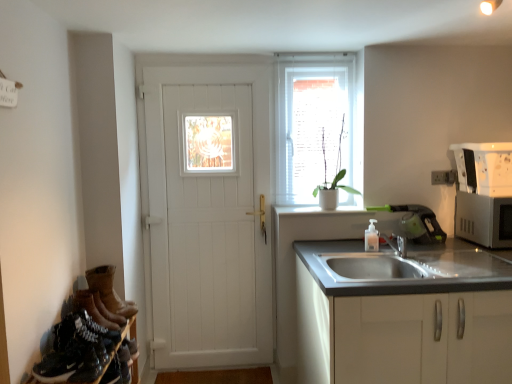
Question: Is black leather shoes at lower left in front of white wooden door at center?

Choices:
 (A) no
 (B) yes

Answer: (B)

Question: From the image's perspective, would you say black leather shoes at lower left is shown under white wooden door at center?

Choices:
 (A) yes
 (B) no

Answer: (A)

Question: Is there a large distance between black leather shoes at lower left and white wooden door at center?

Choices:
 (A) no
 (B) yes

Answer: (B)

Question: Is black leather shoes at lower left looking in the opposite direction of white wooden door at center?

Choices:
 (A) no
 (B) yes

Answer: (A)

Question: Is black leather shoes at lower left taller than white wooden door at center?

Choices:
 (A) yes
 (B) no

Answer: (B)

Question: Does black leather shoes at lower left have a greater width compared to white wooden door at center?

Choices:
 (A) yes
 (B) no

Answer: (A)

Question: Does white matte window at center have a smaller size compared to white wooden door at center?

Choices:
 (A) no
 (B) yes

Answer: (B)

Question: Is white matte window at center not inside white wooden door at center?

Choices:
 (A) yes
 (B) no

Answer: (A)

Question: From a real-world perspective, is white matte window at center located beneath white wooden door at center?

Choices:
 (A) no
 (B) yes

Answer: (A)

Question: From the image's perspective, does white matte window at center appear higher than white wooden door at center?

Choices:
 (A) no
 (B) yes

Answer: (B)

Question: Considering the relative sizes of white matte window at center and white wooden door at center in the image provided, is white matte window at center shorter than white wooden door at center?

Choices:
 (A) yes
 (B) no

Answer: (A)

Question: Does white matte window at center have a greater width compared to white wooden door at center?

Choices:
 (A) yes
 (B) no

Answer: (B)

Question: Considering the relative positions of silver metallic microwave at right and brown suede boots at lower left in the image provided, is silver metallic microwave at right behind brown suede boots at lower left?

Choices:
 (A) no
 (B) yes

Answer: (B)